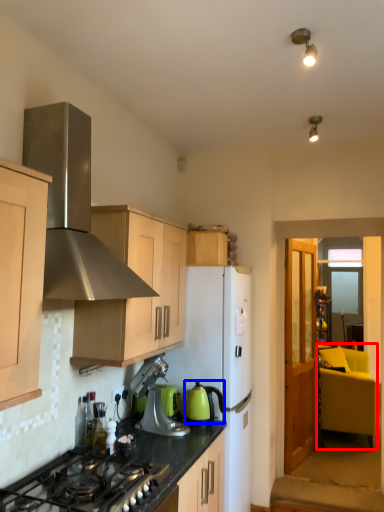
Question: Which object is further to the camera taking this photo, armchair (highlighted by a red box) or kitchen appliance (highlighted by a blue box)?

Choices:
 (A) armchair
 (B) kitchen appliance

Answer: (A)